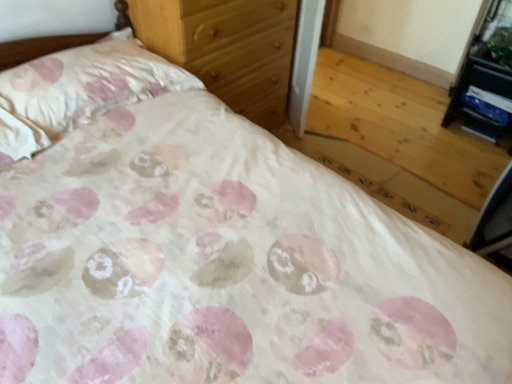
Question: From a real-world perspective, relative to black plastic vanity at upper right, is wooden chest of drawers at upper center vertically above or below?

Choices:
 (A) below
 (B) above

Answer: (B)

Question: In terms of width, does wooden chest of drawers at upper center look wider or thinner when compared to black plastic vanity at upper right?

Choices:
 (A) wide
 (B) thin

Answer: (A)

Question: Based on their relative distances, which object is farther from the black plastic vanity at upper right?

Choices:
 (A) wooden chest of drawers at upper center
 (B) pink satin pillow at upper left

Answer: (B)

Question: Estimate the real-world distances between objects in this image. Which object is closer to the wooden chest of drawers at upper center?

Choices:
 (A) black plastic vanity at upper right
 (B) pink satin pillow at upper left

Answer: (B)